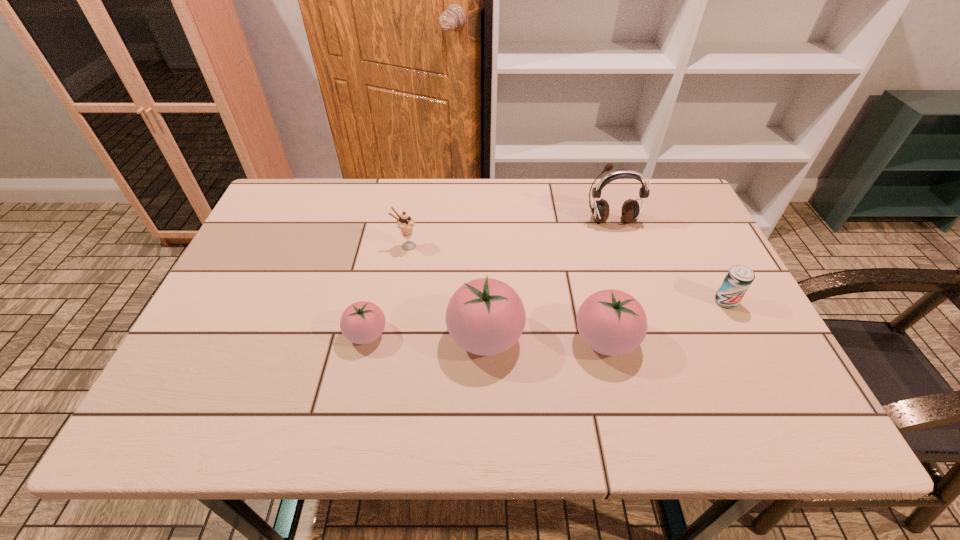
This screenshot has height=540, width=960. I want to click on the shortest tomato, so click(363, 322).

The height and width of the screenshot is (540, 960). Find the location of `the shortest object`. the shortest object is located at coordinates (363, 322).

The height and width of the screenshot is (540, 960). In order to click on the second tomato from left to right in this screenshot , I will do `click(485, 316)`.

This screenshot has height=540, width=960. Identify the location of the rightmost tomato. (611, 322).

At what (x,y) coordinates should I click in order to perform the action: click on the rightmost object. Please return your answer as a coordinate pair (x, y). This screenshot has width=960, height=540. Looking at the image, I should click on (739, 278).

Where is `the second farthest object`? the second farthest object is located at coordinates (405, 223).

Find the location of a particular element. This screenshot has width=960, height=540. the farthest object is located at coordinates (630, 212).

Where is `earphone`? The image size is (960, 540). earphone is located at coordinates (630, 212).

I want to click on vacant space located on the right of the shortest tomato, so click(x=544, y=334).

Find the location of a particular element. This screenshot has width=960, height=540. vacant area situated on the left of the second tomato from right to left is located at coordinates (391, 336).